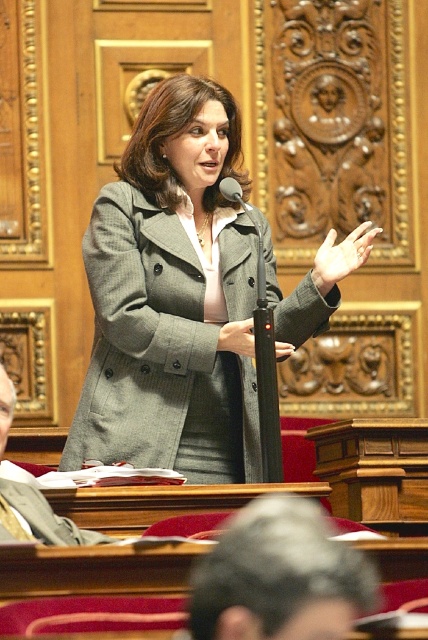
Question: Can you confirm if gray wool coat at center is positioned below matte gray coat at center?

Choices:
 (A) no
 (B) yes

Answer: (A)

Question: Does gray wool coat at center appear over matte gray coat at center?

Choices:
 (A) yes
 (B) no

Answer: (A)

Question: Which object is farther from the camera taking this photo?

Choices:
 (A) gray wool coat at center
 (B) matte gray coat at center

Answer: (A)

Question: Which object appears farthest from the camera in this image?

Choices:
 (A) matte gray coat at center
 (B) gray wool coat at center

Answer: (B)

Question: Does gray wool coat at center appear on the left side of matte gray coat at center?

Choices:
 (A) yes
 (B) no

Answer: (B)